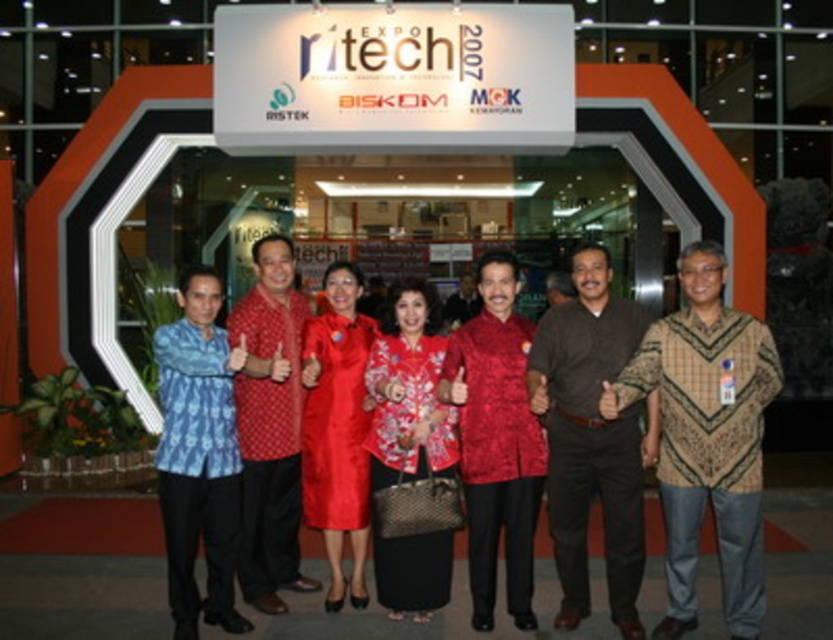
Question: Based on their relative distances, which object is nearer to the brown cotton shirt at center?

Choices:
 (A) shiny red fabric shirt at center
 (B) blue batik shirt at center
 (C) brown batik shirt at center
 (D) embroidered silk dress at center

Answer: (C)

Question: Does brown batik shirt at center have a larger size compared to brown cotton shirt at center?

Choices:
 (A) yes
 (B) no

Answer: (A)

Question: Which object is the farthest from the embroidered silk dress at center?

Choices:
 (A) blue batik shirt at center
 (B) shiny red fabric shirt at center
 (C) red batik shirt at center

Answer: (A)

Question: Does red batik shirt at center have a larger size compared to silky red dress at center?

Choices:
 (A) yes
 (B) no

Answer: (A)

Question: Which is nearer to the red batik shirt at center?

Choices:
 (A) embroidered silk dress at center
 (B) brown batik shirt at center
 (C) blue batik shirt at center
 (D) shiny red fabric shirt at center

Answer: (C)

Question: Can you confirm if shiny red fabric shirt at center is positioned above embroidered silk dress at center?

Choices:
 (A) yes
 (B) no

Answer: (A)